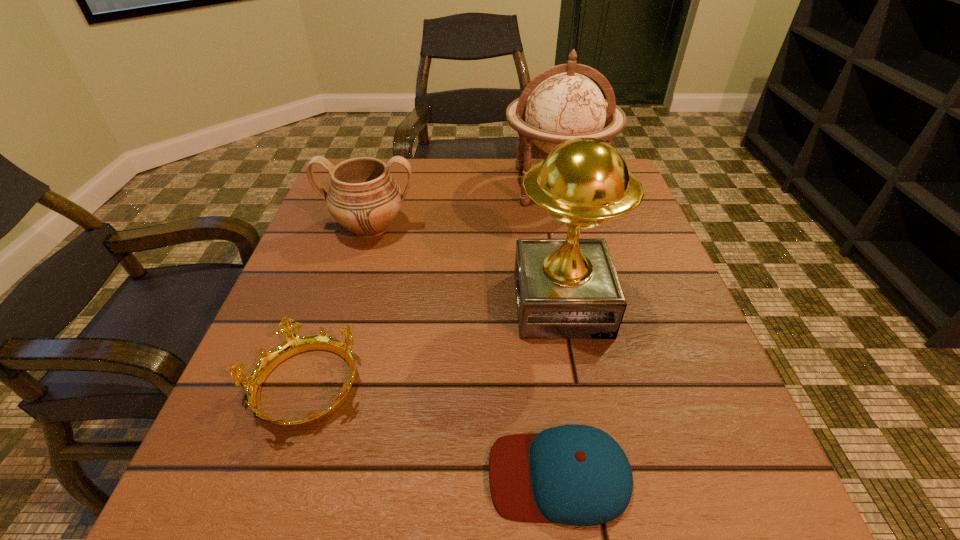
Where is `award that is at the right edge`? The height and width of the screenshot is (540, 960). award that is at the right edge is located at coordinates (568, 288).

The width and height of the screenshot is (960, 540). Find the location of `object located in the far left corner section of the desktop`. object located in the far left corner section of the desktop is located at coordinates (363, 197).

The image size is (960, 540). I want to click on object that is at the far right corner, so click(565, 105).

The width and height of the screenshot is (960, 540). Identify the location of blank space at the far edge. (422, 181).

Find the location of a particular element. This screenshot has width=960, height=540. free space at the near edge of the desktop is located at coordinates (317, 495).

Locate an element on the screen. The height and width of the screenshot is (540, 960). blank space at the left edge is located at coordinates (365, 274).

This screenshot has height=540, width=960. I want to click on vacant space at the right edge, so click(x=674, y=329).

Identify the location of free space at the near right corner of the desktop. coord(729,526).

Where is `vacant space in between the globe and the urn`? This screenshot has width=960, height=540. vacant space in between the globe and the urn is located at coordinates (464, 206).

This screenshot has width=960, height=540. I want to click on empty space that is in between the baseball cap and the award, so click(561, 389).